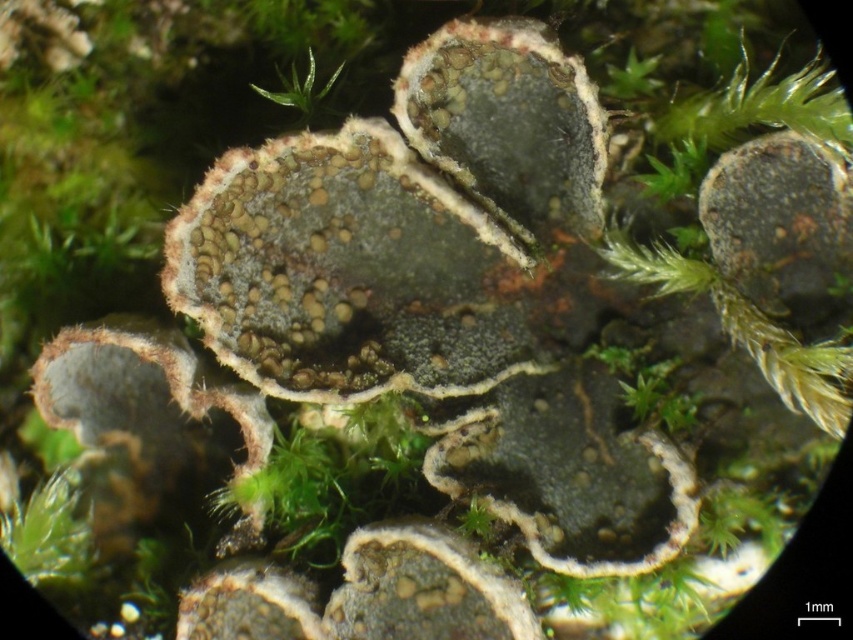
You are a botanist examining a sample of the matte gray lichen at upper right and the speckled gray rock at center. Which object has a smaller thickness?

The matte gray lichen at upper right is thinner than the speckled gray rock at center, so the matte gray lichen at upper right has a smaller thickness.

You are a botanist examining the lichen and moss under a microscope. You notice two points marked on the image at coordinates point [408,68] and point [286,77]. Which point is closer to your eye level when observing through the microscope?

Point [408,68] is closer to the viewer than point [286,77].

You are a botanist examining a sample under a microscope. You observe the dark gray textured lichen at center and the speckled gray rock at center. Which object is closer to the microscope lens?

The dark gray textured lichen at center is closer to the microscope lens because it is in front of the speckled gray rock at center.